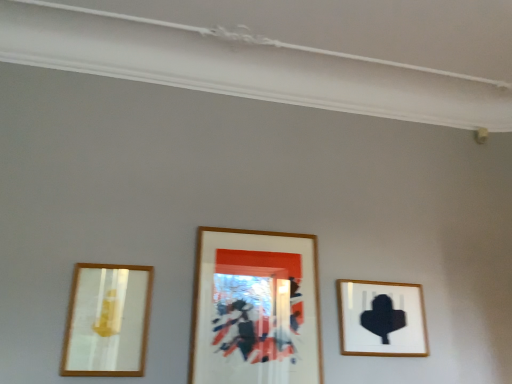
Question: Is matte black silhouette at right, which is counted as the first picture frame, starting from the right, at the left side of matte gold mirror at left, arranged as the third picture frame when viewed from the right?

Choices:
 (A) no
 (B) yes

Answer: (A)

Question: From the image's perspective, is matte black silhouette at right, which is counted as the first picture frame, starting from the right, over matte gold mirror at left, arranged as the third picture frame when viewed from the right?

Choices:
 (A) yes
 (B) no

Answer: (B)

Question: Would you say matte black silhouette at right, the 3th picture frame when ordered from left to right, is a long distance from matte gold mirror at left, arranged as the first picture frame when viewed from the left?

Choices:
 (A) no
 (B) yes

Answer: (B)

Question: Is matte black silhouette at right, which is counted as the first picture frame, starting from the right, wider than matte gold mirror at left, arranged as the third picture frame when viewed from the right?

Choices:
 (A) yes
 (B) no

Answer: (A)

Question: Is matte black silhouette at right, the 3th picture frame when ordered from left to right, in front of matte gold mirror at left, arranged as the first picture frame when viewed from the left?

Choices:
 (A) no
 (B) yes

Answer: (A)

Question: Is matte black silhouette at right, the 3th picture frame when ordered from left to right, completely or partially outside of matte gold mirror at left, arranged as the third picture frame when viewed from the right?

Choices:
 (A) no
 (B) yes

Answer: (B)

Question: Considering the relative sizes of wooden framed artwork at center, the second picture frame positioned from the right, and matte gold mirror at left, arranged as the third picture frame when viewed from the right, in the image provided, is wooden framed artwork at center, the second picture frame positioned from the right, thinner than matte gold mirror at left, arranged as the third picture frame when viewed from the right,?

Choices:
 (A) no
 (B) yes

Answer: (A)

Question: From a real-world perspective, is wooden framed artwork at center, the second picture frame positioned from the right, located higher than matte gold mirror at left, arranged as the third picture frame when viewed from the right?

Choices:
 (A) yes
 (B) no

Answer: (A)

Question: Can you confirm if wooden framed artwork at center, the second picture frame positioned from the right, is smaller than matte gold mirror at left, arranged as the first picture frame when viewed from the left?

Choices:
 (A) no
 (B) yes

Answer: (A)

Question: Is wooden framed artwork at center, the second picture frame positioned from the right, oriented towards matte gold mirror at left, arranged as the first picture frame when viewed from the left?

Choices:
 (A) no
 (B) yes

Answer: (A)

Question: Would you say wooden framed artwork at center, the second picture frame when ordered from left to right, is outside matte gold mirror at left, arranged as the third picture frame when viewed from the right?

Choices:
 (A) no
 (B) yes

Answer: (B)

Question: Considering the relative sizes of wooden framed artwork at center, the second picture frame positioned from the right, and matte gold mirror at left, arranged as the third picture frame when viewed from the right, in the image provided, is wooden framed artwork at center, the second picture frame positioned from the right, wider than matte gold mirror at left, arranged as the third picture frame when viewed from the right,?

Choices:
 (A) yes
 (B) no

Answer: (A)

Question: Is matte gold mirror at left, arranged as the first picture frame when viewed from the left, wider than matte black silhouette at right, the 3th picture frame when ordered from left to right?

Choices:
 (A) no
 (B) yes

Answer: (A)